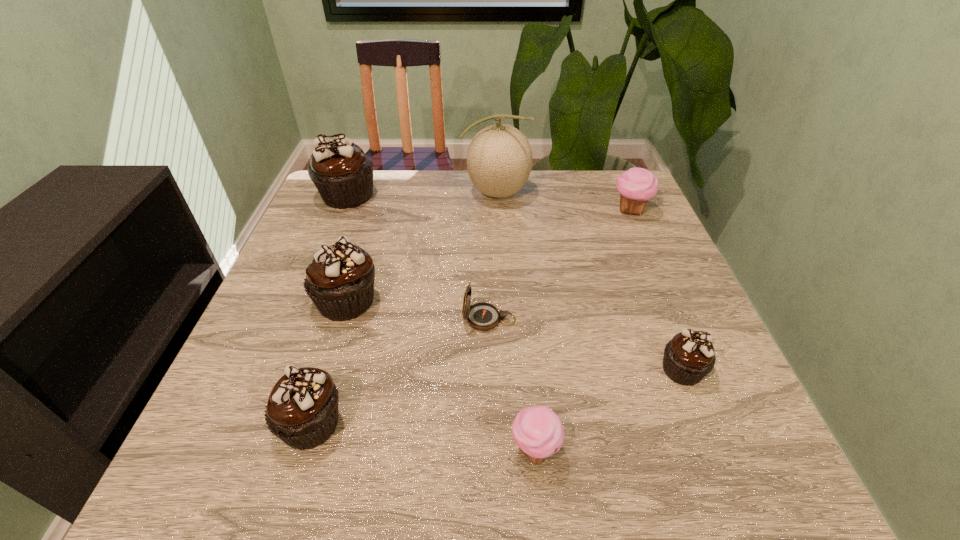
You are a GUI agent. You are given a task and a screenshot of the screen. Output one action in this format:
    pyautogui.click(x=<x>, y=<y>)
    Task: Click on the rightmost brown cupcake
    The height and width of the screenshot is (540, 960).
    Given the screenshot: What is the action you would take?
    pyautogui.click(x=689, y=356)

You are a GUI agent. You are given a task and a screenshot of the screen. Output one action in this format:
    pyautogui.click(x=<x>, y=<y>)
    Task: Click on the smaller pink cupcake
    The width and height of the screenshot is (960, 540).
    Given the screenshot: What is the action you would take?
    pyautogui.click(x=538, y=432)

Identify the location of the left pink cupcake. (538, 432).

Locate an element on the screen. This screenshot has width=960, height=540. free location located on the left of the cantaloup is located at coordinates (382, 192).

This screenshot has height=540, width=960. In order to click on vacant space located 0.360m on the front of the tallest cupcake in this screenshot , I will do `click(300, 311)`.

The width and height of the screenshot is (960, 540). I want to click on vacant space located 0.270m on the right of the third smallest brown cupcake, so (505, 301).

Where is `vacant space situated on the left of the bigger pink cupcake`? vacant space situated on the left of the bigger pink cupcake is located at coordinates (502, 210).

In order to click on vacant space located on the back of the second smallest brown cupcake in this screenshot , I will do `click(341, 326)`.

The image size is (960, 540). In order to click on free space located on the face of the compass in this screenshot , I will do `click(323, 319)`.

At what (x,y) coordinates should I click in order to perform the action: click on vacant space situated 0.070m on the face of the compass. Please return your answer as a coordinate pair (x, y). Image resolution: width=960 pixels, height=540 pixels. Looking at the image, I should click on (429, 319).